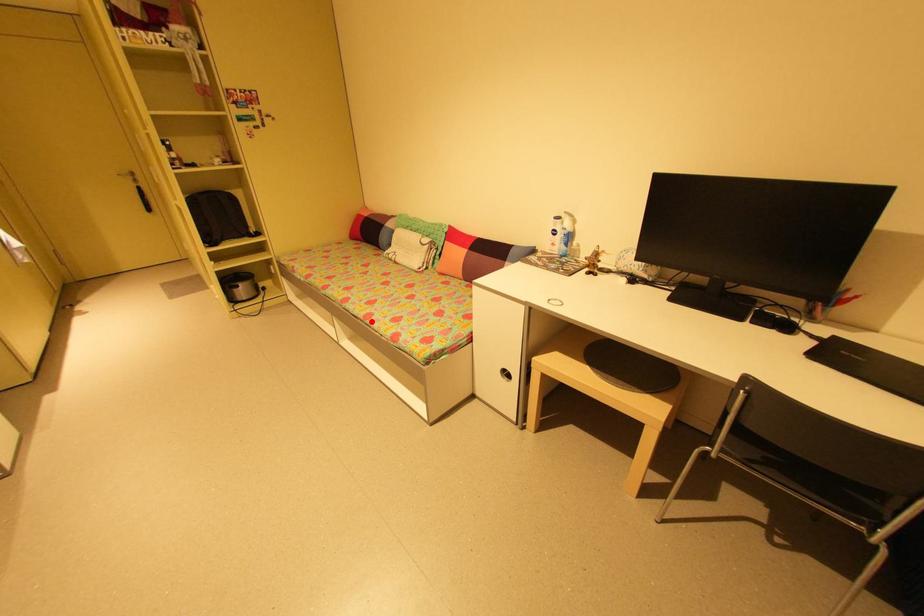
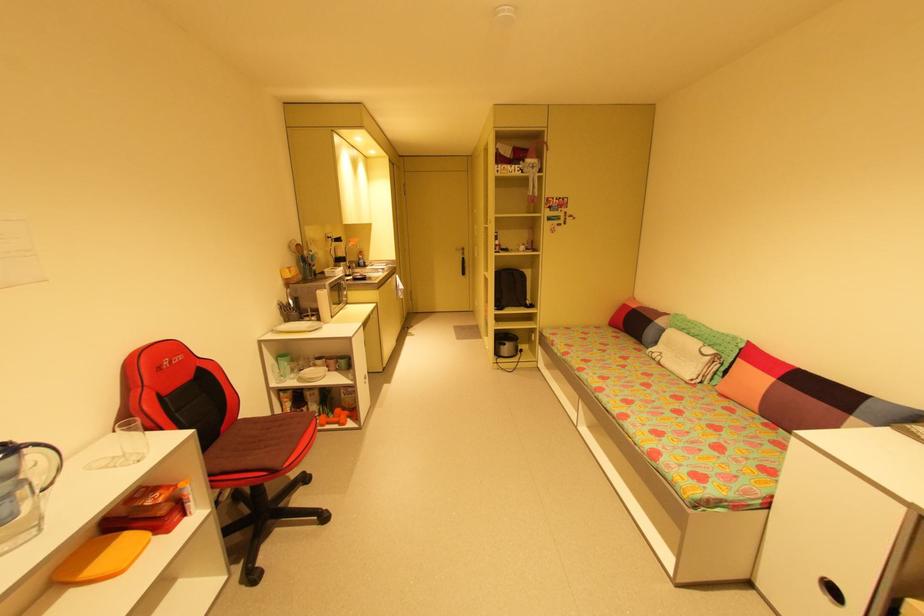
The point at the highlighted location is marked in the first image. Where is the corresponding point in the second image?

(625, 422)